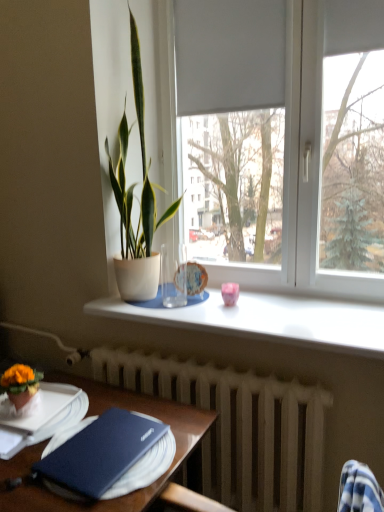
Locate an element on the screen. This screenshot has width=384, height=512. empty space that is ontop of wooden table at lower left (from a real-world perspective) is located at coordinates (71, 432).